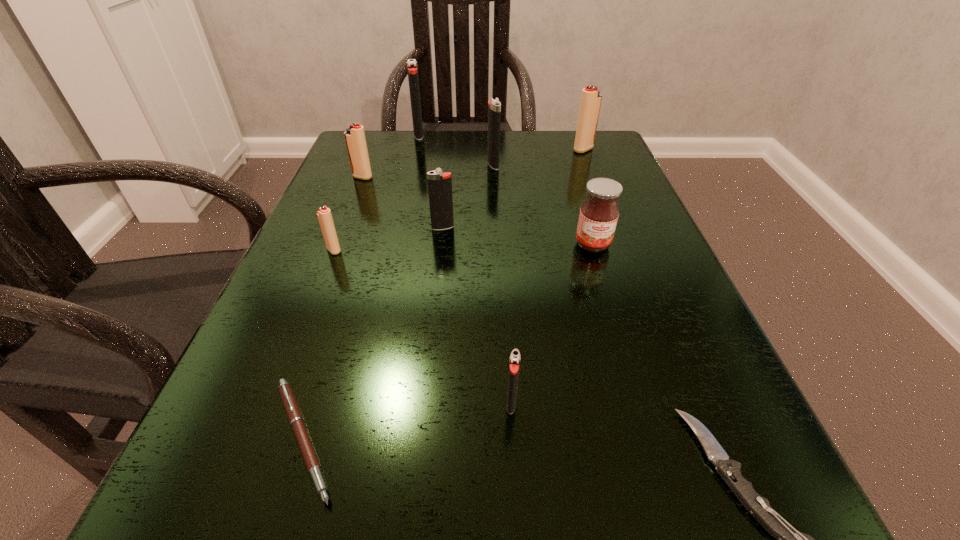
Find the location of a particular element. the third igniter from left to right is located at coordinates (412, 69).

Where is `the farthest object`? This screenshot has width=960, height=540. the farthest object is located at coordinates (412, 69).

You are a GUI agent. You are given a task and a screenshot of the screen. Output one action in this format:
    pyautogui.click(x=<x>, y=<y>)
    Task: Click on the sixth nearest igniter
    
    Given the screenshot: What is the action you would take?
    pyautogui.click(x=590, y=104)

The image size is (960, 540). I want to click on the rightmost igniter, so click(x=590, y=104).

At what (x,y) coordinates should I click in order to perform the action: click on the third farthest igniter. Please return your answer as a coordinate pair (x, y). The width and height of the screenshot is (960, 540). Looking at the image, I should click on pos(494,111).

This screenshot has width=960, height=540. I want to click on the eighth nearest object, so click(494, 111).

Locate an element on the screen. This screenshot has height=540, width=960. the third black igniter from right to left is located at coordinates (439, 184).

Where is `the third nearest igniter`? The image size is (960, 540). the third nearest igniter is located at coordinates (439, 184).

Identify the location of the seventh nearest object. (355, 139).

Locate an element on the screen. This screenshot has width=960, height=540. the fourth nearest igniter is located at coordinates (355, 139).